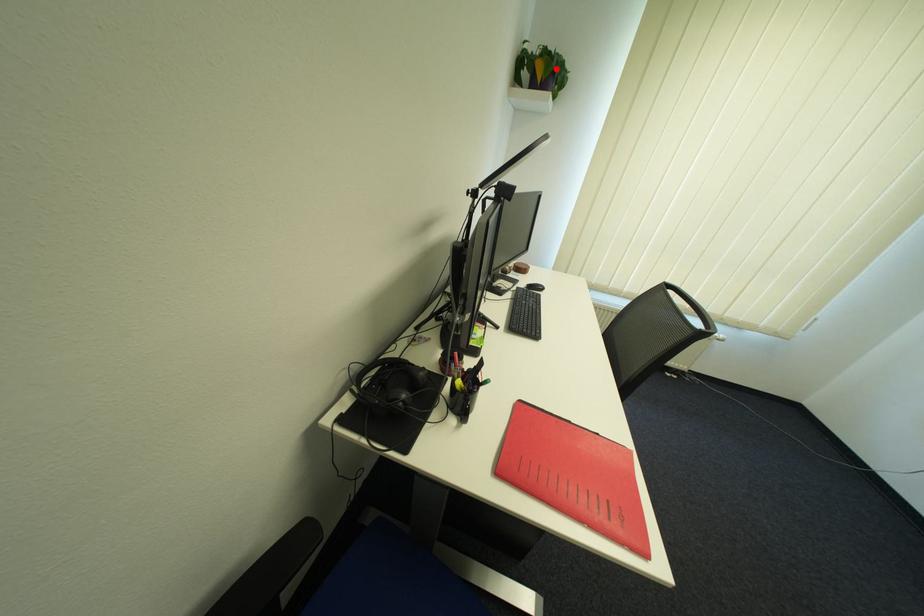
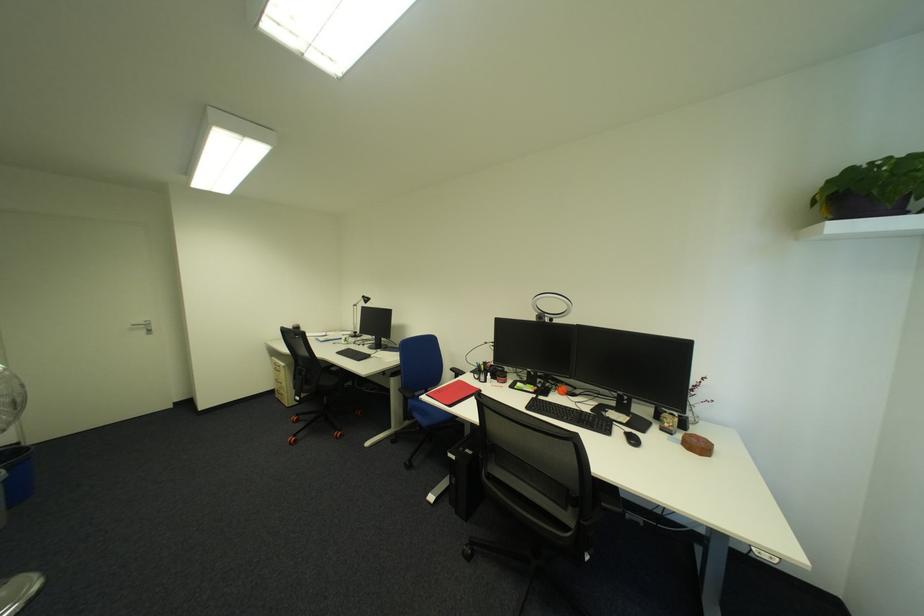
In the second image, find the point that corresponds to the highlighted location in the first image.

(831, 200)